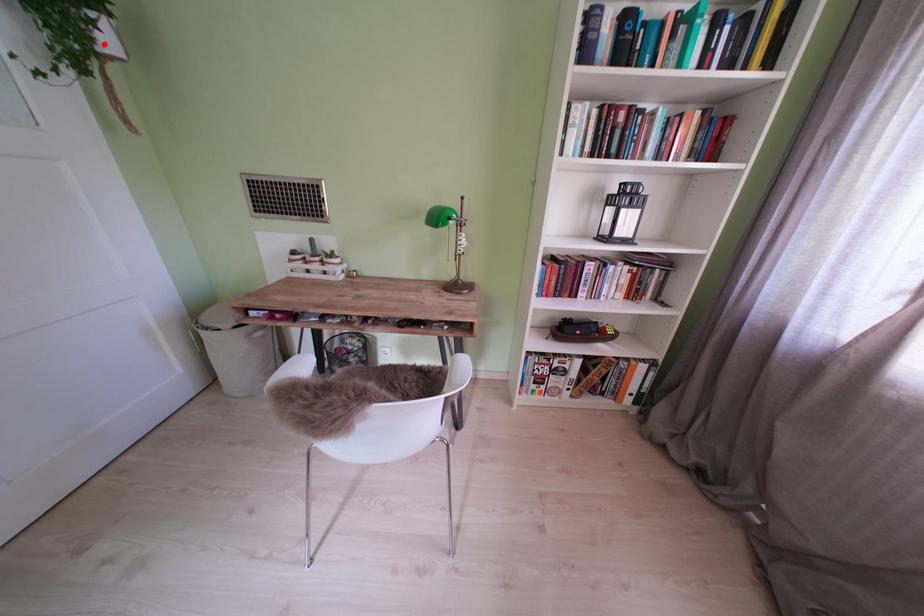
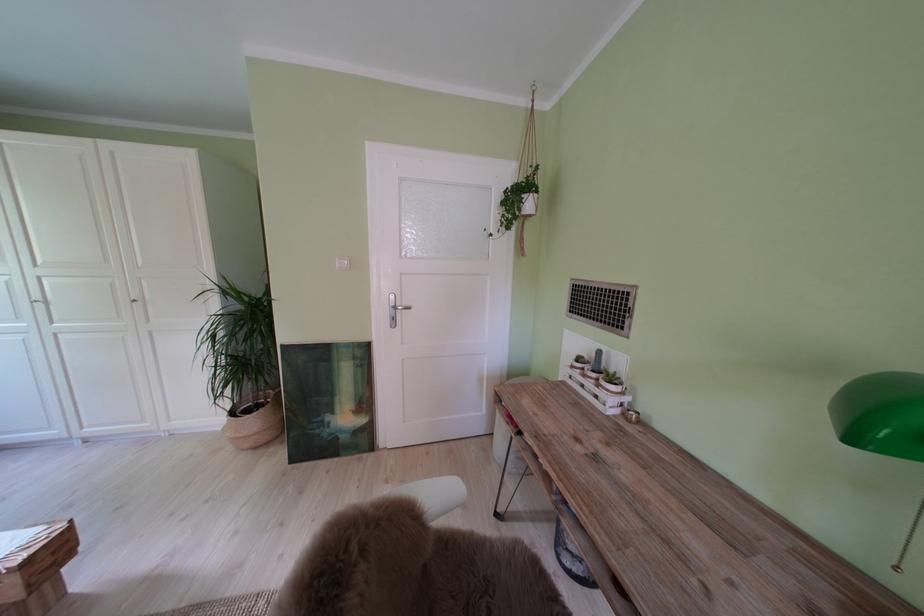
Where in the second image is the point corresponding to the highlighted location from the first image?

(530, 215)